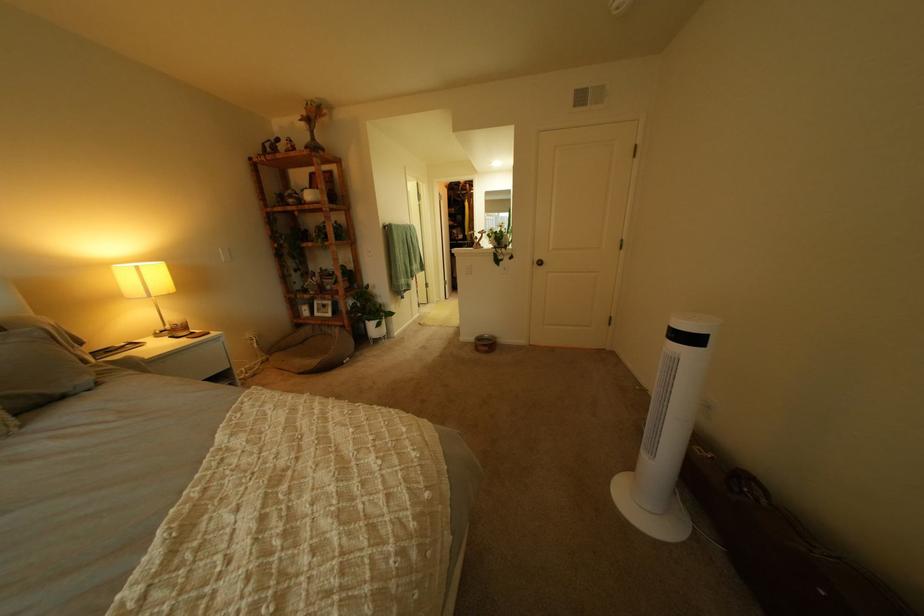
The width and height of the screenshot is (924, 616). Identify the location of lamp switch. (159, 331).